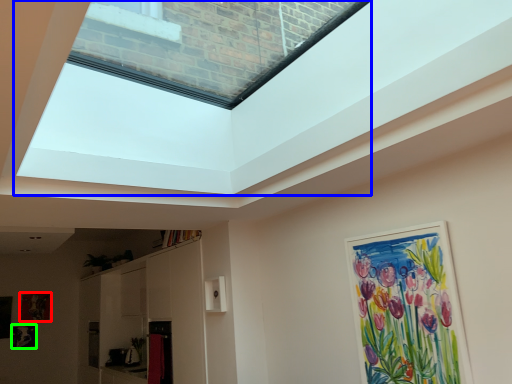
Question: Based on their relative distances, which object is farther from picture frame (highlighted by a red box)? Choose from window screen (highlighted by a blue box) and picture frame (highlighted by a green box).

Choices:
 (A) window screen
 (B) picture frame

Answer: (A)